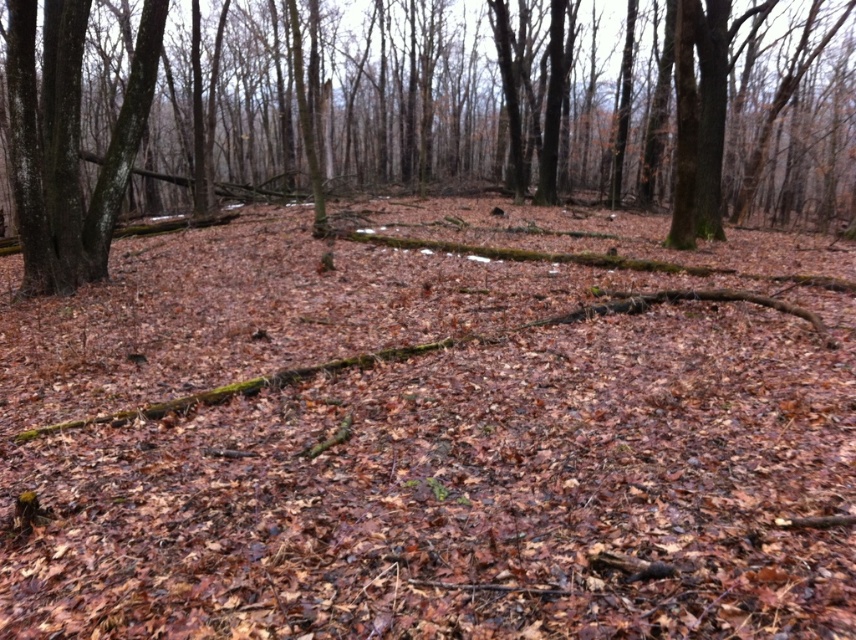
Question: Does brown bark tree at center have a greater width compared to smooth bark tree at left?

Choices:
 (A) yes
 (B) no

Answer: (A)

Question: Which point is closer to the camera taking this photo?

Choices:
 (A) (34, 74)
 (B) (73, 100)

Answer: (A)

Question: Can you confirm if brown bark tree at center is positioned above smooth bark tree at left?

Choices:
 (A) no
 (B) yes

Answer: (B)

Question: Which of the following is the farthest from the observer?

Choices:
 (A) brown bark tree at center
 (B) smooth bark tree at left

Answer: (B)

Question: Where is brown bark tree at center located in relation to smooth bark tree at left in the image?

Choices:
 (A) below
 (B) above

Answer: (B)